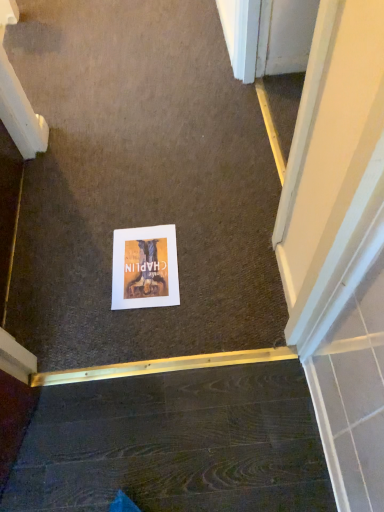
I want to click on free point below white paper at center (from a real-world perspective), so click(142, 270).